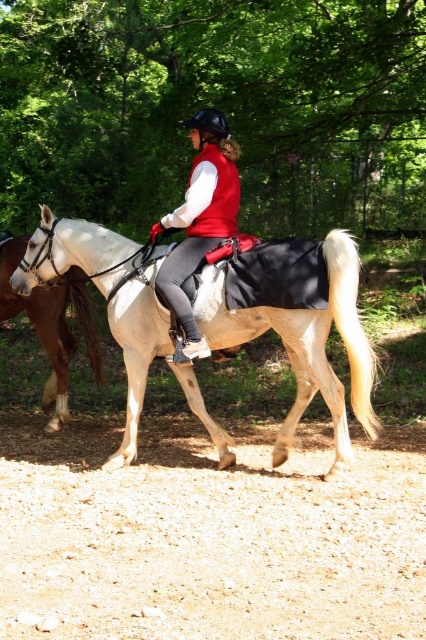
You are a hiker trying to locate the rider wearing the matte red vest at center. You see the green leafy tree at upper center. Which direction should you look to find the rider?

The green leafy tree at upper center is above the matte red vest at center, so you should look downward from the green leafy tree at upper center to locate the rider wearing the matte red vest at center.

You are a horse trainer who needs to separate two horses. You see the light beige fabric horse at center and the brown glossy horse at left. Can you fit a 6.5 feet wide fence between them without moving the horses?

The light beige fabric horse at center and the brown glossy horse at left are 6.57 feet apart from each other. Since the fence is 6.5 feet wide, it can be placed between them as the distance between the horses is slightly larger than the fence width.

In the scene shown: Based on the scene description, where exactly is the light beige fabric horse at center located in terms of coordinates?

The light beige fabric horse at center is located at coordinates point (307,346).